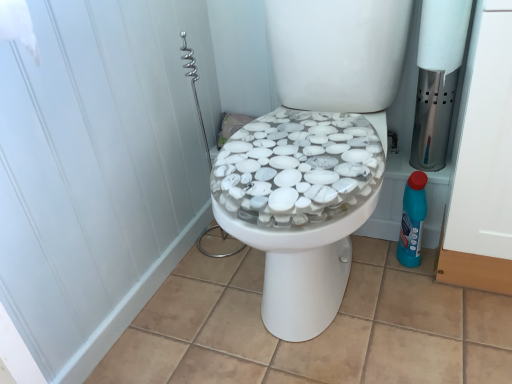
This screenshot has width=512, height=384. I want to click on free space in front of blue plastic bottle at right, so click(428, 295).